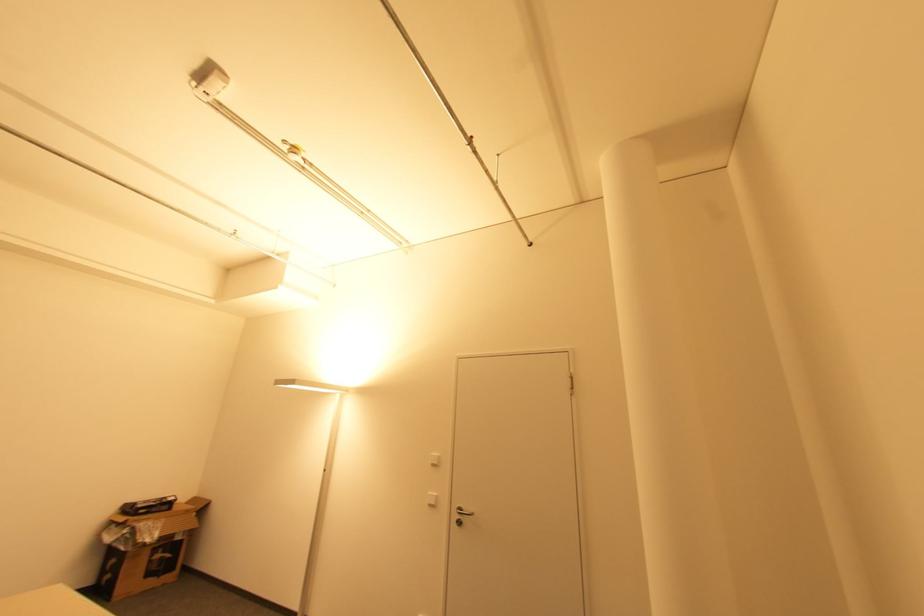
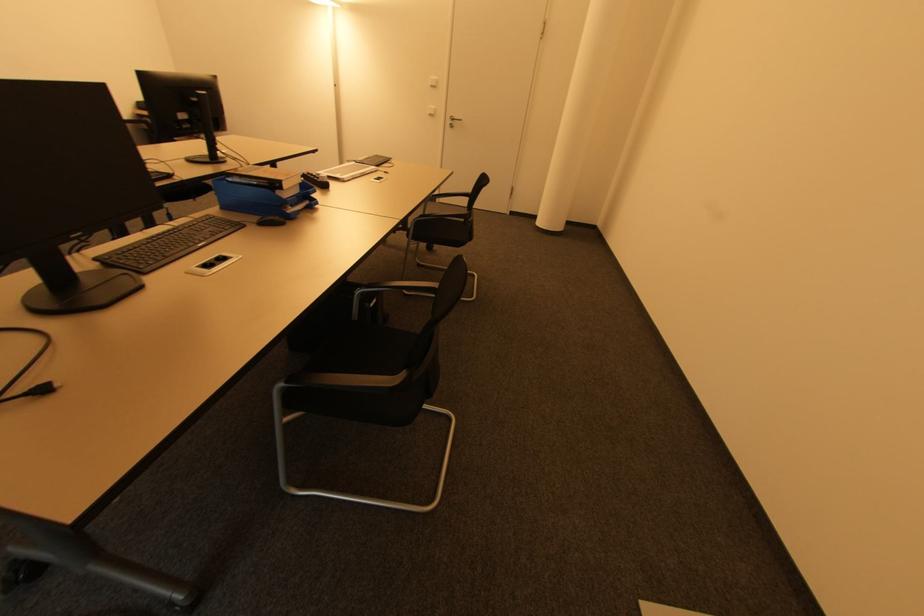
Find the pixel in the second image that matches (435,466) in the first image.

(434, 87)